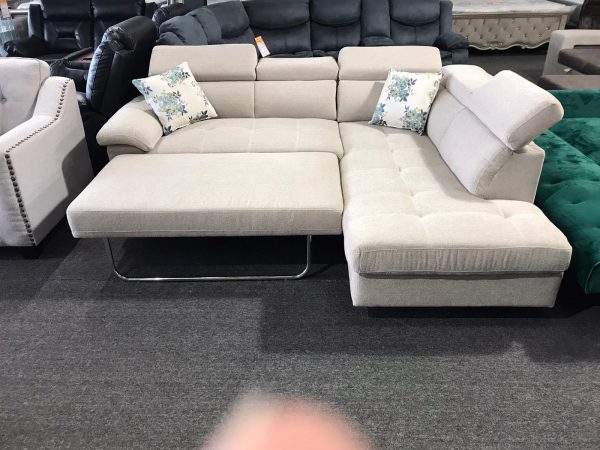
Locate an element on the screen. The image size is (600, 450). grey carpet is located at coordinates (436, 351), (109, 363), (163, 336), (62, 378).